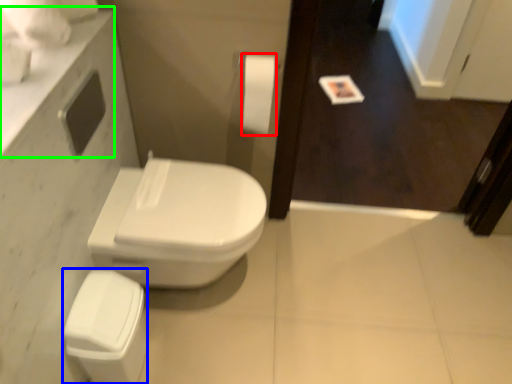
Question: Considering the real-world distances, which object is closest to toilet paper (highlighted by a red box)? porcelain (highlighted by a blue box) or counter top (highlighted by a green box).

Choices:
 (A) porcelain
 (B) counter top

Answer: (B)